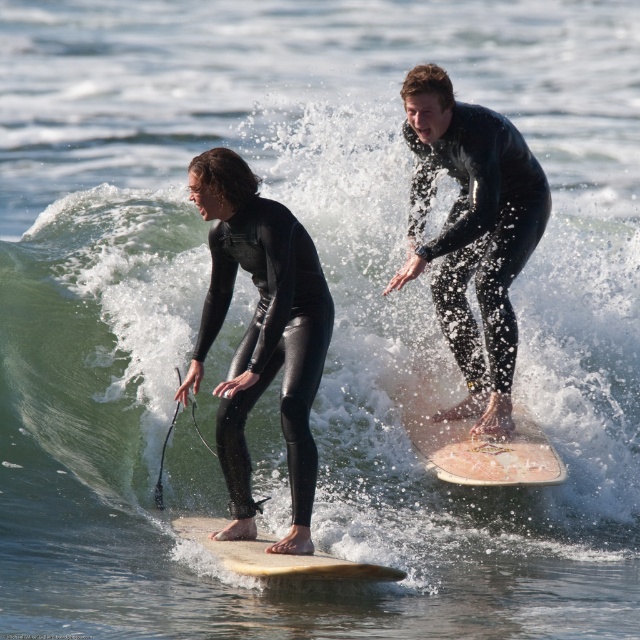
You are a photographer trying to capture the black glossy wetsuit at center in your shot. The camera you are using has a focal length of 50mm. Based on the scene description, where should you position the camera relative to the point marked at coordinates point (x=268, y=340) to ensure the wetsuit is in focus?

The black glossy wetsuit at center is located at point (x=268, y=340), so positioning the camera directly facing this point with the focal length set to 50mm will ensure the wetsuit is in focus.

You are a photographer trying to capture a clear shot of the light brown smooth surfboard at center without the black glossy wetsuit at center blocking it. Is this possible given their current positions?

The black glossy wetsuit at center is positioned over the light brown smooth surfboard at center, so it is blocking the surfboard. Therefore, it is not possible to capture a clear shot of the light brown smooth surfboard at center without the black glossy wetsuit at center blocking it.

You are a photographer trying to capture a shot of both surfers. You notice the black matte wetsuit at upper center and the black glossy wetsuit at center. Which surfer is positioned to the right side of the other?

The black matte wetsuit at upper center is to the right of the black glossy wetsuit at center.